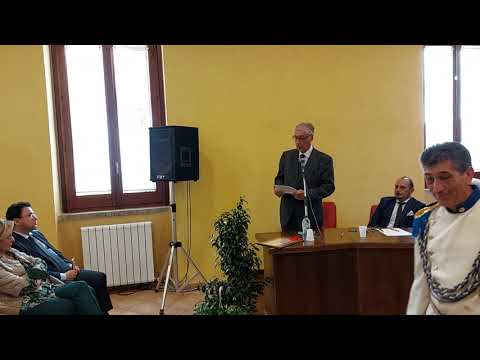
Locate an element on the screen. The width and height of the screenshot is (480, 360). wall is located at coordinates (242, 126).